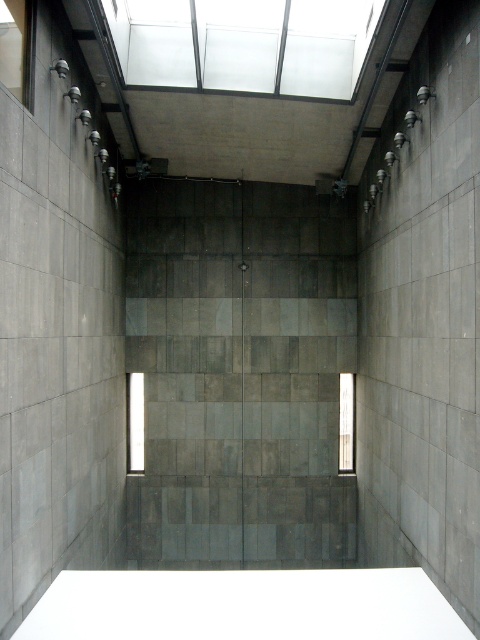
You are standing in the minimalist interior space. You need to locate the transparent glass window at upper left. Where exactly is it positioned in terms of its 2D coordinates?

The transparent glass window at upper left is positioned at the coordinates point (17, 49).

You are standing in the room and want to look through the transparent glass window at center and the clear glass window at center. Which window allows you to see more details of the outside world?

The transparent glass window at center is closer to the viewer than the clear glass window at center, so it allows you to see more details of the outside world.

You are standing at the point marked as point [1,54]. You want to walk to the other side of the room. The distance between you and the opposite wall is 22.35 feet. If you walk at a speed of 3 feet per second, how many seconds will it take you to reach the opposite wall?

The distance between you and the opposite wall is 22.35 feet. At a speed of 3 feet per second, it will take you 22.35 divided by 3, which equals approximately 7.45 seconds to reach the opposite wall.